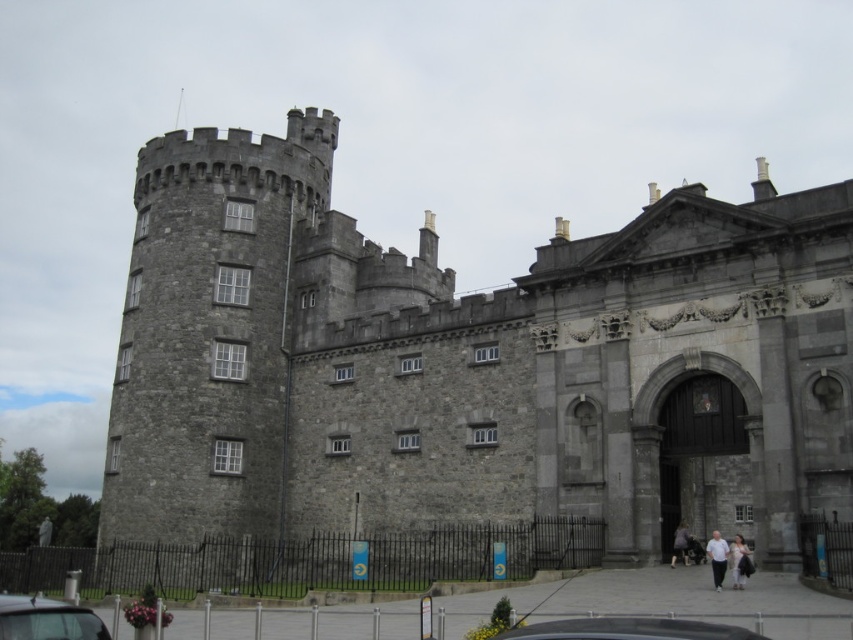
Question: Can you confirm if gray stone castle at left is wider than dark gray stone person at center?

Choices:
 (A) yes
 (B) no

Answer: (A)

Question: Does gray stone castle at left appear on the right side of dark gray fabric jacket at lower right?

Choices:
 (A) no
 (B) yes

Answer: (A)

Question: Considering the real-world distances, which object is farthest from the gray stone castle at left?

Choices:
 (A) dark gray stone person at center
 (B) white cotton shirt at lower right
 (C) dark gray fabric jacket at lower right

Answer: (C)

Question: Estimate the real-world distances between objects in this image. Which object is closer to the gray stone castle at left?

Choices:
 (A) dark gray stone person at center
 (B) dark gray fabric jacket at lower right

Answer: (A)

Question: Estimate the real-world distances between objects in this image. Which object is closer to the white cotton shirt at lower right?

Choices:
 (A) dark gray stone person at center
 (B) gray stone castle at left

Answer: (A)

Question: In this image, where is metallic gray car at center located relative to dark gray fabric jacket at lower right?

Choices:
 (A) above
 (B) below

Answer: (A)